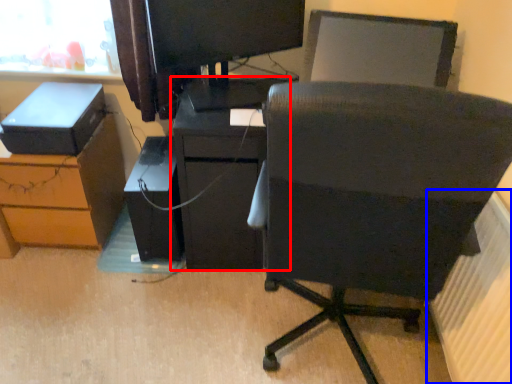
Question: Among these objects, which one is farthest to the camera, furniture (highlighted by a red box) or radiator (highlighted by a blue box)?

Choices:
 (A) furniture
 (B) radiator

Answer: (A)